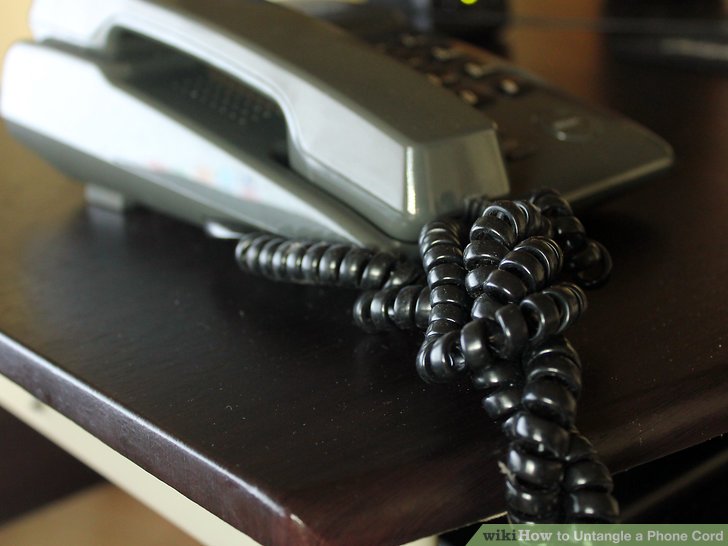
Where is `phone`? The height and width of the screenshot is (546, 728). phone is located at coordinates (325, 52).